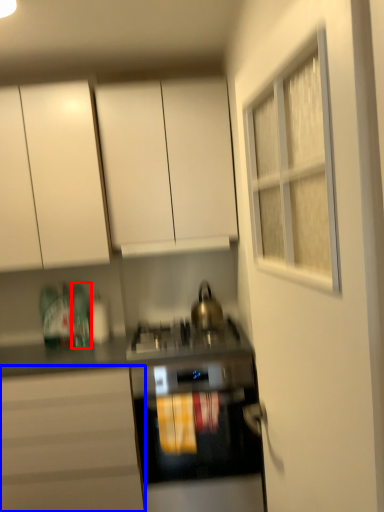
Question: Which object appears farthest to the camera in this image, bottle (highlighted by a red box) or cabinetry (highlighted by a blue box)?

Choices:
 (A) bottle
 (B) cabinetry

Answer: (A)